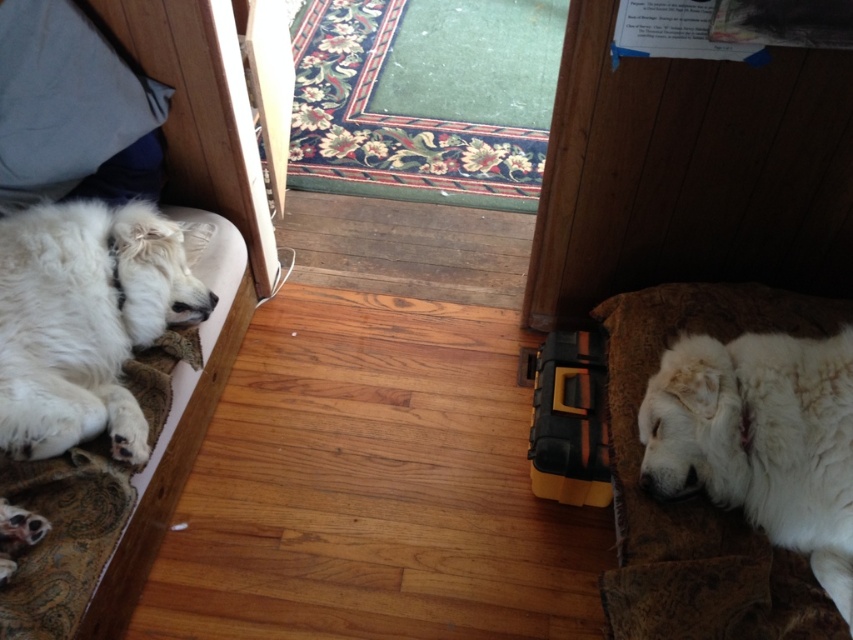
Question: Does white fluffy dog at left have a lesser width compared to white fluffy dog at right?

Choices:
 (A) no
 (B) yes

Answer: (B)

Question: Where is white fluffy dog at right located in relation to blue fabric pillow at upper left in the image?

Choices:
 (A) below
 (B) above

Answer: (A)

Question: Which point is farther to the camera?

Choices:
 (A) white fluffy dog at left
 (B) white soft bed at left
 (C) white fluffy dog at right
 (D) blue fabric pillow at upper left

Answer: (D)

Question: Which object is the farthest from the blue fabric pillow at upper left?

Choices:
 (A) white fluffy dog at left
 (B) white fluffy dog at right

Answer: (B)

Question: From the image, what is the correct spatial relationship of white soft bed at left in relation to blue fabric pillow at upper left?

Choices:
 (A) left
 (B) right

Answer: (B)

Question: Which point is closer to the camera?

Choices:
 (A) white fluffy dog at left
 (B) blue fabric pillow at upper left
 (C) white soft bed at left
 (D) white fluffy dog at right

Answer: (D)